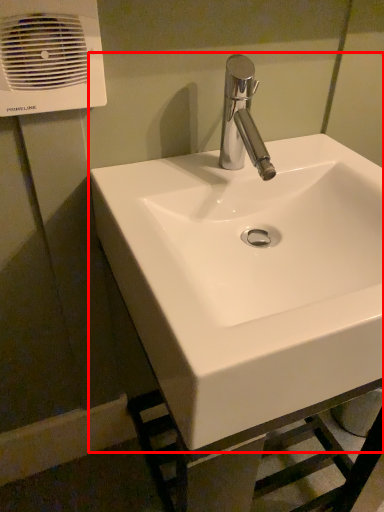
Question: From the image's perspective, considering the relative positions of sink (annotated by the red box) and air conditioning in the image provided, where is sink (annotated by the red box) located with respect to the staircase?

Choices:
 (A) above
 (B) below

Answer: (B)